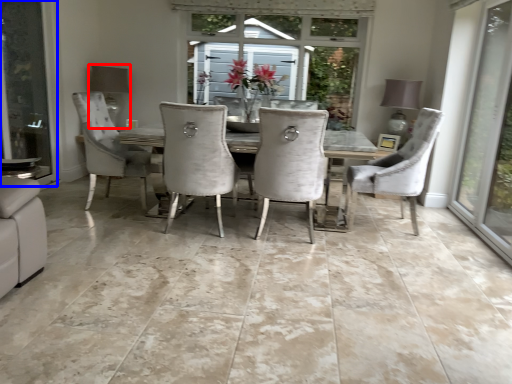
Question: Which object is closer to the camera taking this photo, lamp (highlighted by a red box) or screen door (highlighted by a blue box)?

Choices:
 (A) lamp
 (B) screen door

Answer: (B)